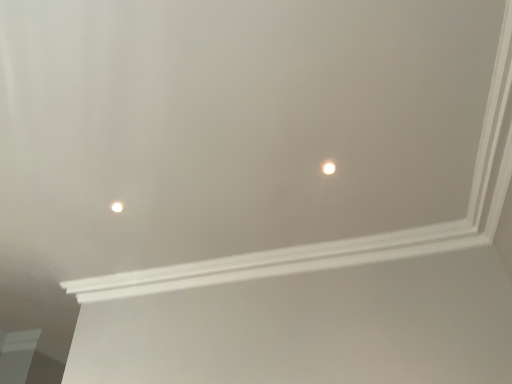
Question: Is matte white light at upper left, which is counted as the 1th light, starting from the back, shorter than white glossy light at upper center, the 1th light viewed from the top?

Choices:
 (A) no
 (B) yes

Answer: (A)

Question: Does matte white light at upper left, marked as the 1th light in a bottom-to-top arrangement, have a greater height compared to white glossy light at upper center, which is the 2th light in bottom-to-top order?

Choices:
 (A) no
 (B) yes

Answer: (B)

Question: Does matte white light at upper left, marked as the 2th light in a top-to-bottom arrangement, have a smaller size compared to white glossy light at upper center, which is the second light from back to front?

Choices:
 (A) no
 (B) yes

Answer: (A)

Question: Does matte white light at upper left, which is the 2th light in front-to-back order, come behind white glossy light at upper center, acting as the second light starting from the left?

Choices:
 (A) yes
 (B) no

Answer: (A)

Question: Is matte white light at upper left, arranged as the 1th light when viewed from the left, closer to camera compared to white glossy light at upper center, the first light from the right?

Choices:
 (A) yes
 (B) no

Answer: (B)

Question: Does matte white light at upper left, which is counted as the 1th light, starting from the back, turn towards white glossy light at upper center, acting as the second light starting from the left?

Choices:
 (A) no
 (B) yes

Answer: (A)

Question: Considering the relative positions of white glossy light at upper center, the first light from the right, and matte white light at upper left, marked as the 2th light in a top-to-bottom arrangement, in the image provided, is white glossy light at upper center, the first light from the right, to the left of matte white light at upper left, marked as the 2th light in a top-to-bottom arrangement, from the viewer's perspective?

Choices:
 (A) yes
 (B) no

Answer: (B)

Question: From the image's perspective, does white glossy light at upper center, which is the 2th light in bottom-to-top order, appear higher than matte white light at upper left, which is the 2th light in front-to-back order?

Choices:
 (A) no
 (B) yes

Answer: (B)

Question: Does white glossy light at upper center, the first light from the right, have a lesser height compared to matte white light at upper left, arranged as the 1th light when viewed from the left?

Choices:
 (A) yes
 (B) no

Answer: (A)

Question: Is white glossy light at upper center, which is the second light from back to front, facing towards matte white light at upper left, which is counted as the 1th light, starting from the back?

Choices:
 (A) yes
 (B) no

Answer: (B)

Question: Is white glossy light at upper center, the first light positioned from the front, bigger than matte white light at upper left, marked as the 2th light in a top-to-bottom arrangement?

Choices:
 (A) no
 (B) yes

Answer: (A)

Question: Is white glossy light at upper center, the 1th light viewed from the top, smaller than matte white light at upper left, arranged as the 1th light when viewed from the left?

Choices:
 (A) yes
 (B) no

Answer: (A)

Question: Would you say matte white light at upper left, the second light viewed from the right, is inside or outside white glossy light at upper center, the first light from the right?

Choices:
 (A) inside
 (B) outside

Answer: (B)